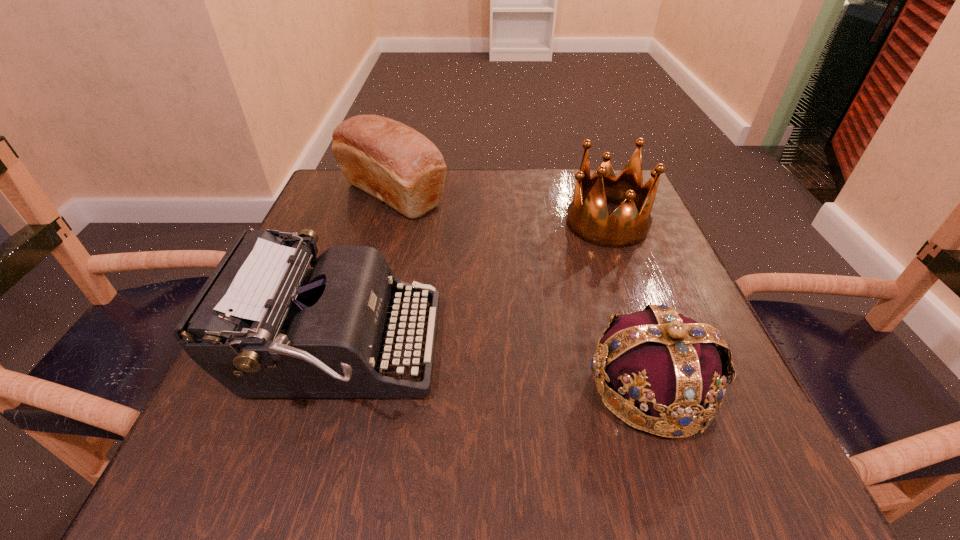
At what (x,y) coordinates should I click in order to perform the action: click on bread. Please return your answer as a coordinate pair (x, y). This screenshot has height=540, width=960. Looking at the image, I should click on (394, 163).

Locate an element on the screen. The height and width of the screenshot is (540, 960). the farther crown is located at coordinates pos(588,218).

Image resolution: width=960 pixels, height=540 pixels. Find the location of `typewriter`. typewriter is located at coordinates (264, 325).

Where is `the nearer crown`? The width and height of the screenshot is (960, 540). the nearer crown is located at coordinates (670, 365).

Locate an element on the screen. vacant region located 0.270m on the right of the bread is located at coordinates (561, 195).

This screenshot has width=960, height=540. What are the coordinates of `vacant position located 0.320m on the left of the farther crown` in the screenshot? It's located at (422, 223).

Find the location of `free spot located on the front-facing side of the typewriter`. free spot located on the front-facing side of the typewriter is located at coordinates (540, 350).

Where is `free space located on the back of the nearer crown`? free space located on the back of the nearer crown is located at coordinates (601, 237).

I want to click on bread that is at the far edge, so click(x=394, y=163).

Identify the location of crown that is at the far edge. The height and width of the screenshot is (540, 960). (588, 218).